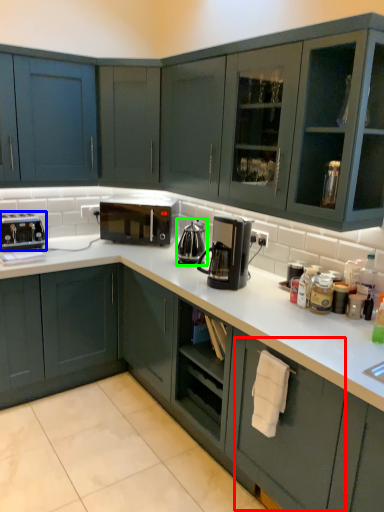
Question: Considering the real-world distances, which object is farthest from drawer (highlighted by a red box)? kitchen appliance (highlighted by a blue box) or coffeepot (highlighted by a green box)?

Choices:
 (A) kitchen appliance
 (B) coffeepot

Answer: (A)